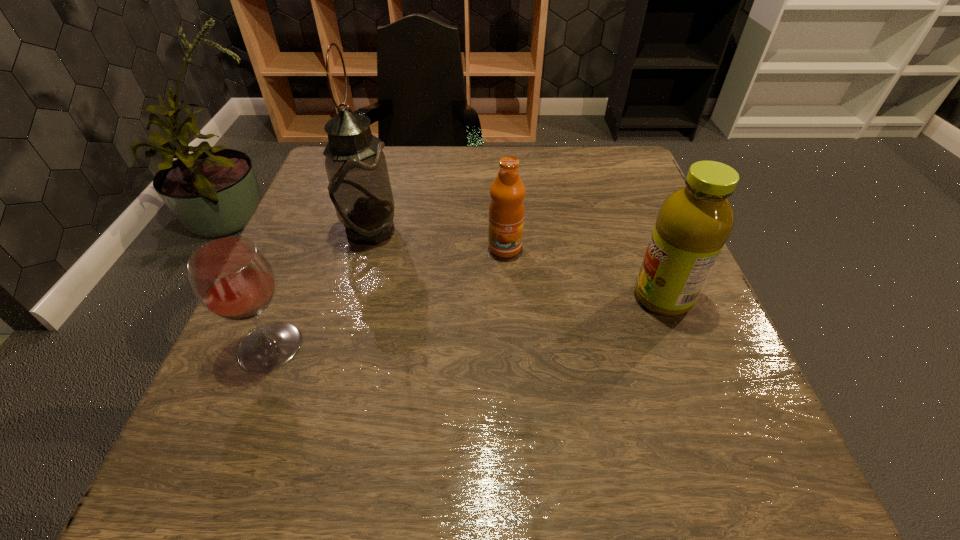
You are a GUI agent. You are given a task and a screenshot of the screen. Output one action in this format:
    pyautogui.click(x=<x>, y=<y>)
    Task: Click on the vacant region located 0.280m on the label side of the farther fruit juice
    This screenshot has width=960, height=540.
    Given the screenshot: What is the action you would take?
    pyautogui.click(x=513, y=380)

In order to click on free spot located on the right of the wineglass in this screenshot , I will do `click(349, 346)`.

The image size is (960, 540). I want to click on oil lamp positioned at the left edge, so click(359, 186).

Find the location of a particular element. wineglass that is at the left edge is located at coordinates (x=231, y=277).

At what (x,y) coordinates should I click in order to perform the action: click on object present at the right edge. Please return your answer as a coordinate pair (x, y). This screenshot has height=540, width=960. Looking at the image, I should click on (694, 222).

The image size is (960, 540). In order to click on free location at the far edge in this screenshot , I will do `click(538, 156)`.

In the image, there is a desktop. At what (x,y) coordinates should I click in order to perform the action: click on vacant area at the near edge. Please return your answer as a coordinate pair (x, y). Looking at the image, I should click on (651, 438).

Image resolution: width=960 pixels, height=540 pixels. I want to click on vacant space at the left edge of the desktop, so click(x=273, y=376).

At what (x,y) coordinates should I click in order to perform the action: click on blank space at the right edge of the desktop. Please return your answer as a coordinate pair (x, y). Looking at the image, I should click on (679, 335).

In the image, there is a desktop. What are the coordinates of `vacant space at the near left corner` in the screenshot? It's located at click(x=270, y=494).